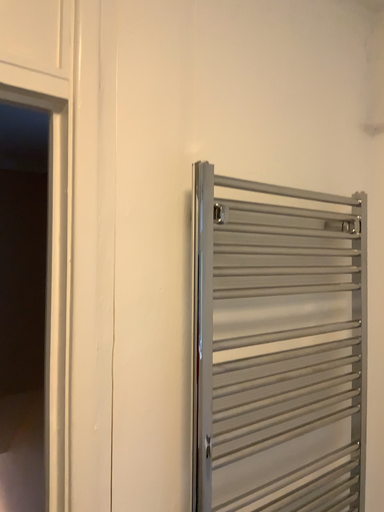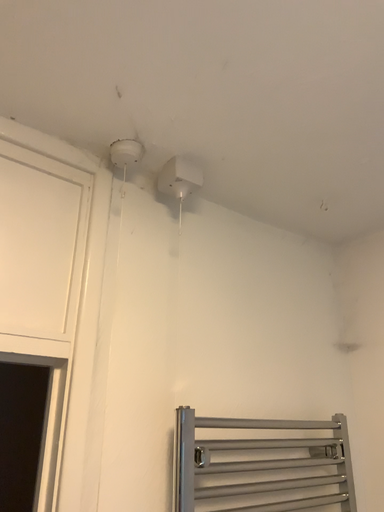
Question: How did the camera likely rotate when shooting the video?

Choices:
 (A) rotated downward
 (B) rotated upward

Answer: (B)